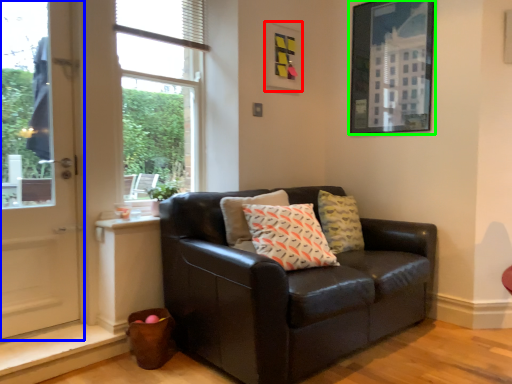
Question: Which object is positioned closest to picture frame (highlighted by a red box)? Select from door (highlighted by a blue box) and picture frame (highlighted by a green box).

Choices:
 (A) door
 (B) picture frame

Answer: (B)